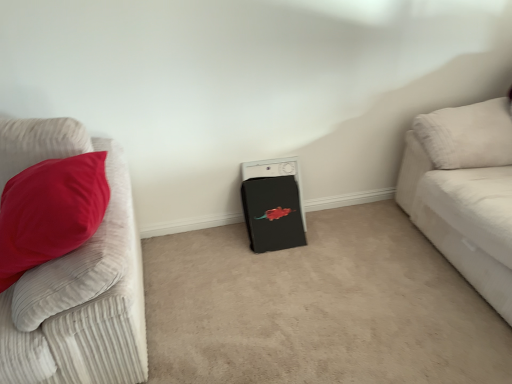
Question: From the image's perspective, is black matte washing machine at center above velvet red pillow at left, placed as the 1th studio couch when sorted from left to right?

Choices:
 (A) no
 (B) yes

Answer: (B)

Question: Is black matte washing machine at center beside velvet red pillow at left, placed as the 1th studio couch when sorted from left to right?

Choices:
 (A) no
 (B) yes

Answer: (A)

Question: Are black matte washing machine at center and velvet red pillow at left, placed as the 2th studio couch when sorted from right to left, far apart?

Choices:
 (A) no
 (B) yes

Answer: (A)

Question: From a real-world perspective, is black matte washing machine at center located beneath velvet red pillow at left, placed as the 1th studio couch when sorted from left to right?

Choices:
 (A) no
 (B) yes

Answer: (B)

Question: Does black matte washing machine at center have a larger size compared to velvet red pillow at left, placed as the 2th studio couch when sorted from right to left?

Choices:
 (A) no
 (B) yes

Answer: (A)

Question: Is black matte washing machine at center at the right side of velvet red pillow at left, placed as the 2th studio couch when sorted from right to left?

Choices:
 (A) yes
 (B) no

Answer: (A)

Question: From the image's perspective, is velvet red pillow at left, placed as the 2th studio couch when sorted from right to left, below white corduroy couch at right, the 2th studio couch when ordered from left to right?

Choices:
 (A) yes
 (B) no

Answer: (A)

Question: Is velvet red pillow at left, placed as the 2th studio couch when sorted from right to left, facing towards white corduroy couch at right, the first studio couch viewed from the right?

Choices:
 (A) yes
 (B) no

Answer: (B)

Question: Is velvet red pillow at left, placed as the 2th studio couch when sorted from right to left, taller than white corduroy couch at right, the first studio couch viewed from the right?

Choices:
 (A) no
 (B) yes

Answer: (A)

Question: Can you confirm if velvet red pillow at left, placed as the 2th studio couch when sorted from right to left, is bigger than white corduroy couch at right, the first studio couch viewed from the right?

Choices:
 (A) no
 (B) yes

Answer: (A)

Question: From a real-world perspective, does velvet red pillow at left, placed as the 2th studio couch when sorted from right to left, stand above white corduroy couch at right, the 2th studio couch when ordered from left to right?

Choices:
 (A) no
 (B) yes

Answer: (B)

Question: Is velvet red pillow at left, placed as the 2th studio couch when sorted from right to left, smaller than white corduroy couch at right, the first studio couch viewed from the right?

Choices:
 (A) no
 (B) yes

Answer: (B)

Question: From a real-world perspective, is white corduroy couch at right, the 2th studio couch when ordered from left to right, below black matte washing machine at center?

Choices:
 (A) yes
 (B) no

Answer: (B)